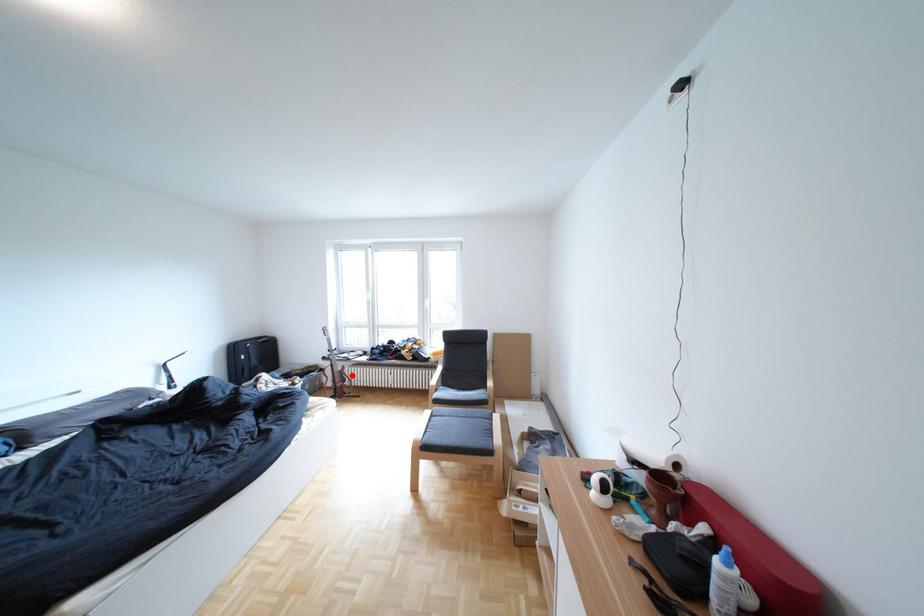
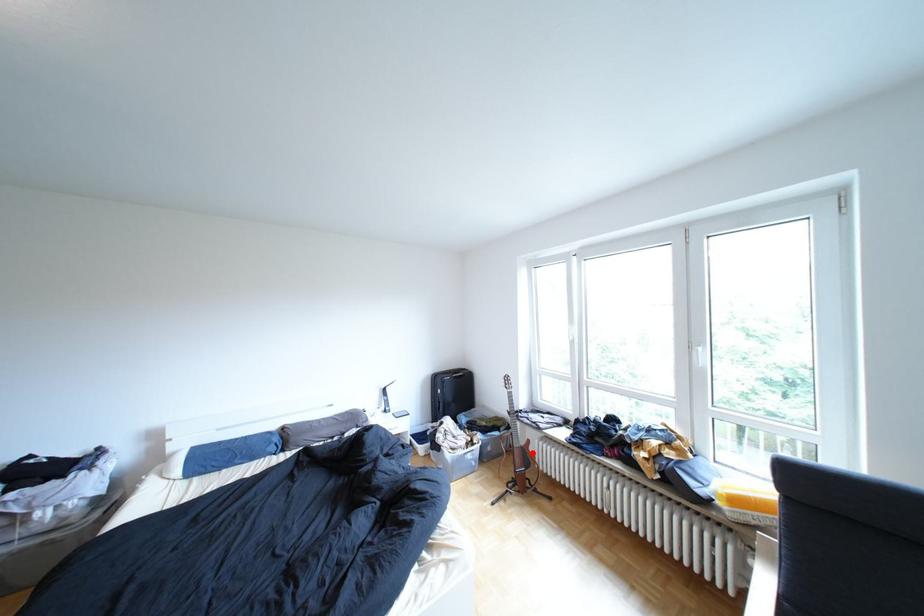
I am providing you with two images of the same scene from different viewpoints. A red point is marked on the first image and another point is marked on the second image. Does the point marked in image1 correspond to the same location as the one in image2?

Yes